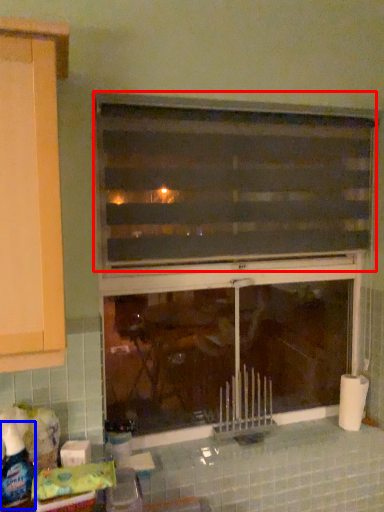
Question: Which object is further to the camera taking this photo, window (highlighted by a red box) or bottle (highlighted by a blue box)?

Choices:
 (A) window
 (B) bottle

Answer: (A)